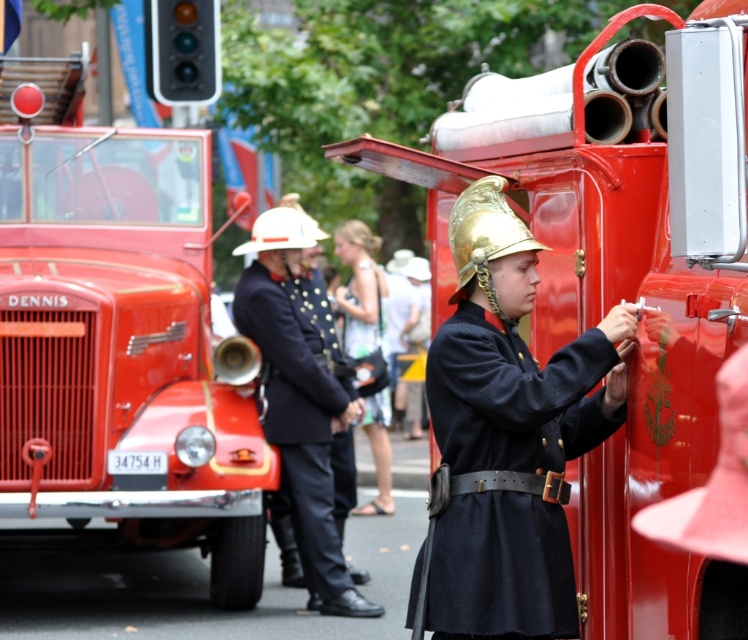
Is shiny red fire truck at left above navy blue fabric coat at center?

Indeed, shiny red fire truck at left is positioned over navy blue fabric coat at center.

Image resolution: width=748 pixels, height=640 pixels. Find the location of `shiny red fire truck at left`. shiny red fire truck at left is located at coordinates (117, 340).

This screenshot has height=640, width=748. I want to click on shiny red fire truck at left, so click(117, 340).

Describe the element at coordinates (117, 340) in the screenshot. The width and height of the screenshot is (748, 640). I see `shiny red fire truck at left` at that location.

Locate an element on the screen. The image size is (748, 640). shiny red fire truck at left is located at coordinates (117, 340).

Looking at this image, between shiny red fire truck at center and navy blue fabric coat at center, which one appears on the right side from the viewer's perspective?

navy blue fabric coat at center is more to the right.

Who is lower down, shiny red fire truck at center or navy blue fabric coat at center?

navy blue fabric coat at center is lower down.

The width and height of the screenshot is (748, 640). Find the location of `shiny red fire truck at center`. shiny red fire truck at center is located at coordinates (601, 307).